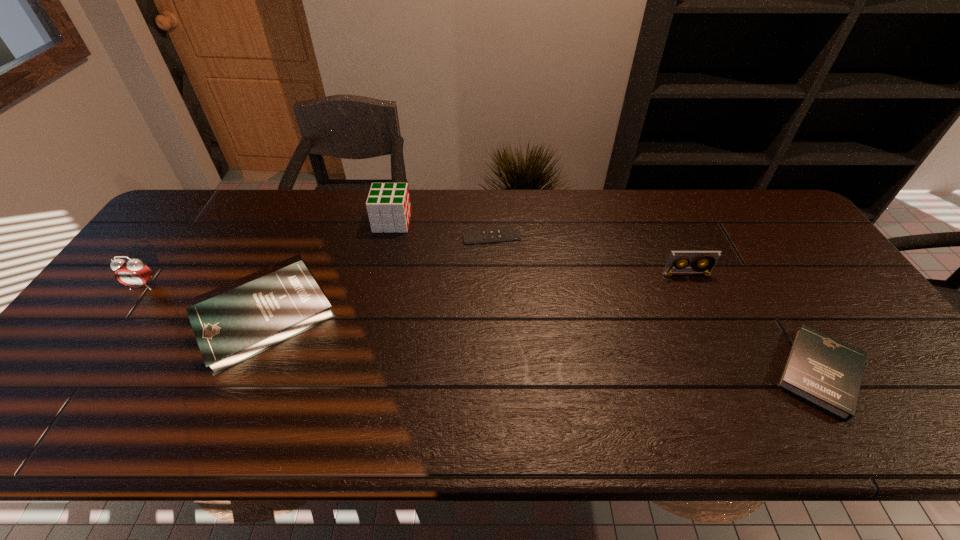
Identify the location of free space located on the right of the left book. Image resolution: width=960 pixels, height=540 pixels. (490, 318).

Where is `vacant space located on the back of the rightmost object`? vacant space located on the back of the rightmost object is located at coordinates (784, 315).

The image size is (960, 540). I want to click on blank area located 0.180m on the back of the shortest object, so click(x=491, y=195).

Image resolution: width=960 pixels, height=540 pixels. What are the coordinates of `free space located 0.270m on the red face of the cube` in the screenshot? It's located at 494,222.

The width and height of the screenshot is (960, 540). I want to click on free region located on the clock face of the leftmost object, so click(x=116, y=323).

I want to click on free space located at the front of the second object from right to left with visible reels, so click(723, 354).

In order to click on remote control that is at the far edge in this screenshot , I will do `click(513, 233)`.

The height and width of the screenshot is (540, 960). Identify the location of cube at the far edge. (388, 205).

I want to click on object that is positioned at the left edge, so click(132, 273).

What are the coordinates of `object present at the right edge` in the screenshot? It's located at (826, 372).